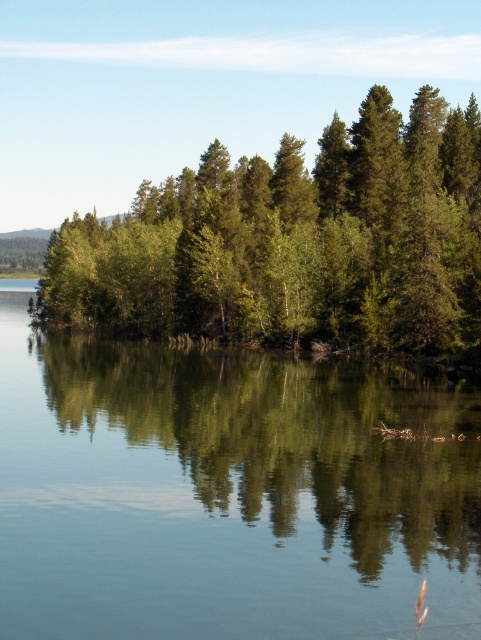
Question: Is green reflective water at center above green matte trees at center?

Choices:
 (A) no
 (B) yes

Answer: (A)

Question: Which object is farther from the camera taking this photo?

Choices:
 (A) green reflective water at center
 (B) green matte trees at center

Answer: (B)

Question: Can you confirm if green reflective water at center is bigger than green matte trees at center?

Choices:
 (A) yes
 (B) no

Answer: (B)

Question: In this image, where is green reflective water at center located relative to green matte trees at center?

Choices:
 (A) right
 (B) left

Answer: (A)